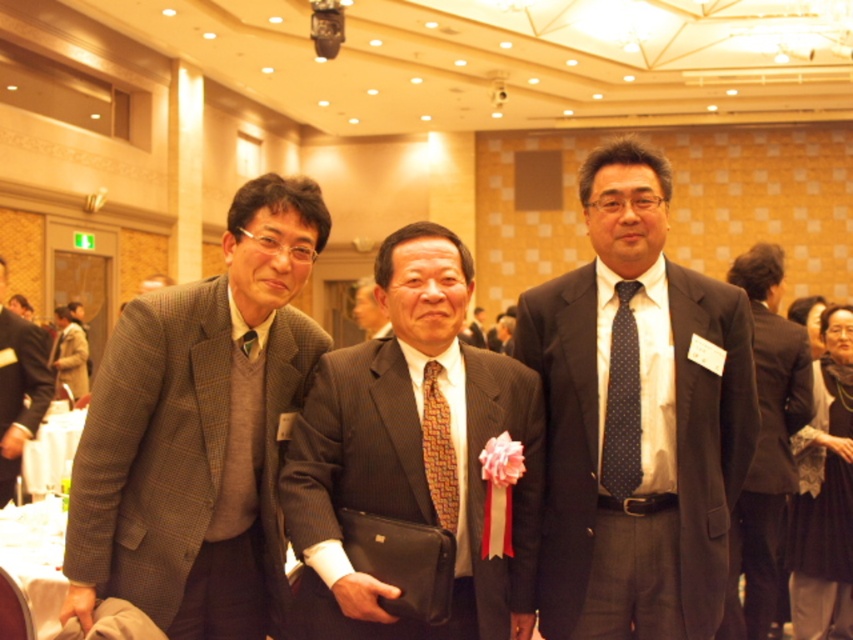
From the picture: You are a photographer positioned at the center of the room. You need to take a photo that includes both the dark gray suit at center and the brown wool jacket at left. Given that your camera has a maximum focus range of 10 meters, will you be able to capture both subjects clearly in the same frame?

The dark gray suit at center is 9.94 meters from the brown wool jacket at left. Since the distance between them is within the camera maximum focus range of 10 meters, both subjects can be captured clearly in the same frame.

You are organizing a charity event and need to decide which outfit to wear. You have two options from the image provided. The first is the brown wool sweater at left and the second is the brown textured suit at center. Based on their thickness, which one would be more appropriate for a formal event?

The brown textured suit at center is thicker than the brown wool sweater at left, making it more suitable for a formal event as thicker fabrics are typically associated with more formal attire.